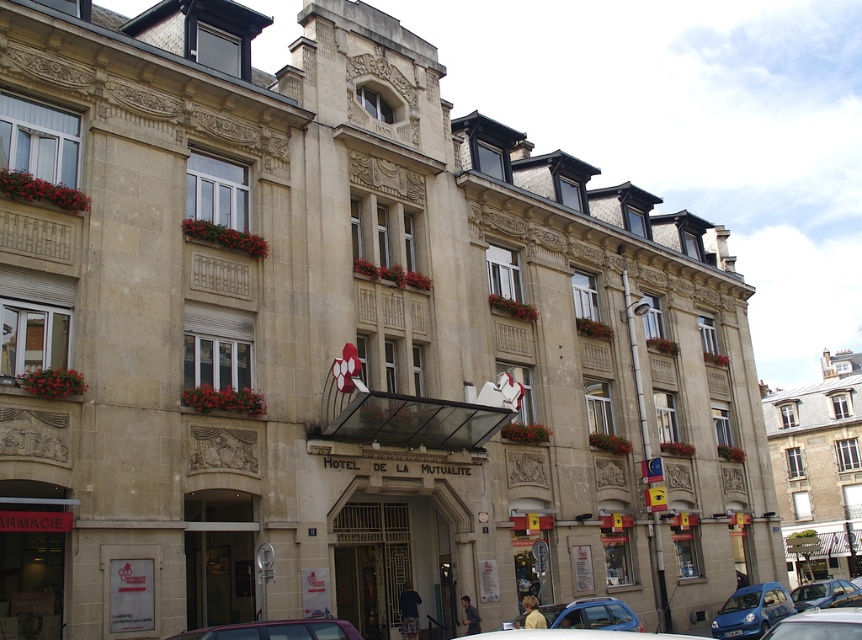
Question: Which point is farther to the camera?

Choices:
 (A) (823, 612)
 (B) (854, 492)

Answer: (B)

Question: Which object appears closest to the camera in this image?

Choices:
 (A) beige stone hotel at center
 (B) metallic gray car at lower center
 (C) metallic blue car at lower right

Answer: (B)

Question: Is beige stone hotel at center behind metallic gray car at lower center?

Choices:
 (A) yes
 (B) no

Answer: (A)

Question: Does beige stone hotel at center appear on the left side of blue metallic car at center?

Choices:
 (A) yes
 (B) no

Answer: (B)

Question: Which point appears farthest from the camera in this image?

Choices:
 (A) (309, 620)
 (B) (798, 618)
 (C) (806, 600)

Answer: (C)

Question: Is beige stone hotel at center positioned at the back of blue metallic car at center?

Choices:
 (A) yes
 (B) no

Answer: (A)